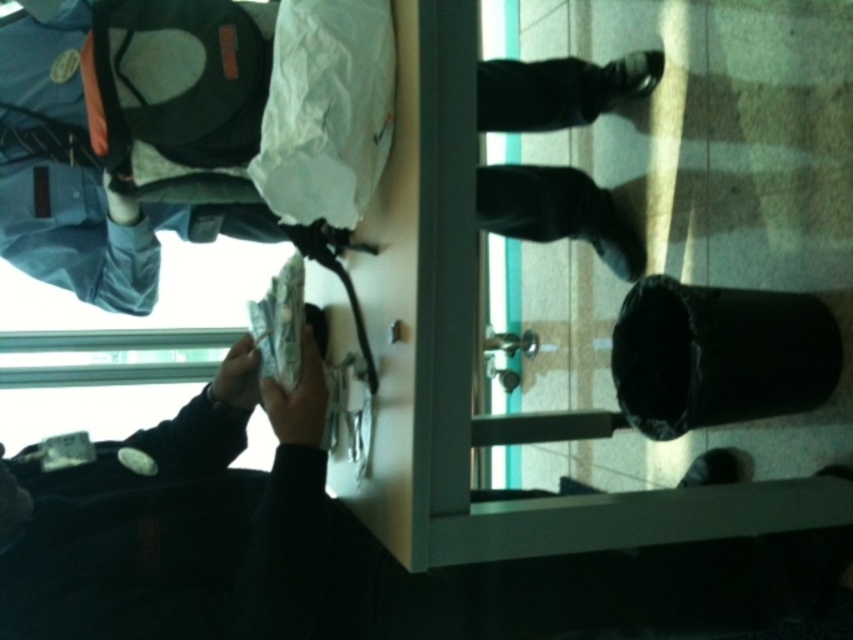
You are a cashier at a store and you need to place the white paper money at lower left and the black leather shoes at center into a bag. Since the bag can only hold one item at a time, which item should you place first to ensure proper placement according to their positions?

The white paper money at lower left should be placed first because it is to the left of the black leather shoes at center, so placing it first maintains their left to right order.

You are a cashier at a store and you see the white paper money at lower left and the black leather shoes at center. Which object is shorter in height?

The white paper money at lower left is shorter than the black leather shoes at center.